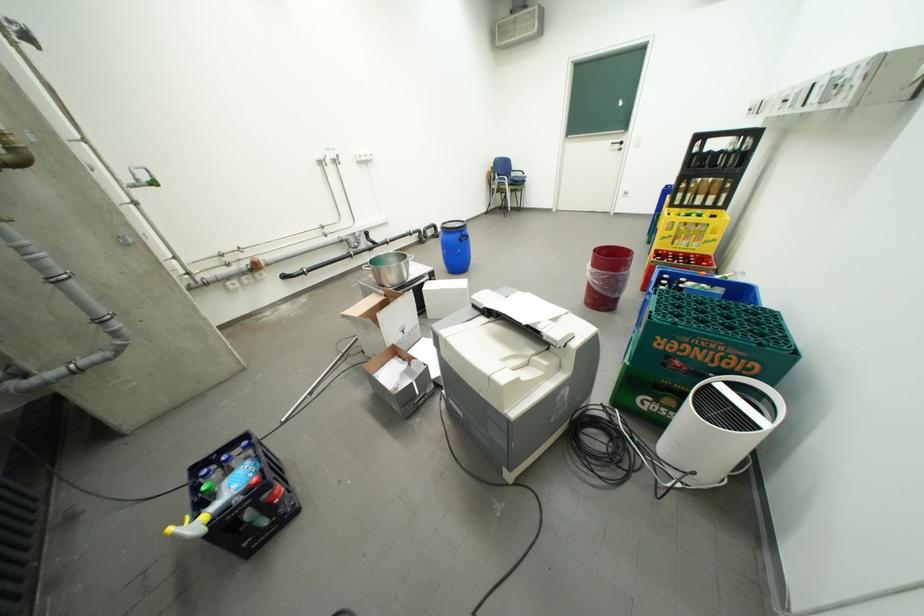
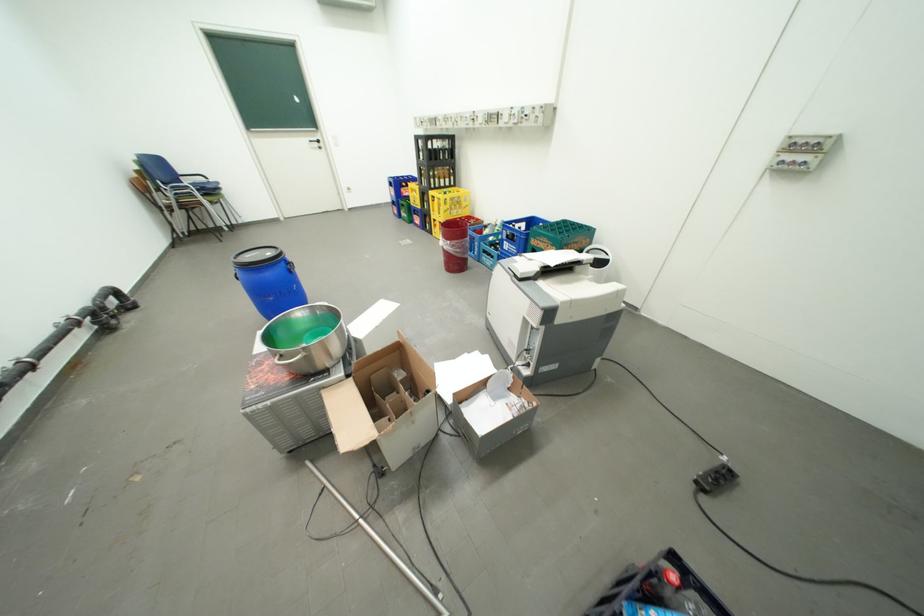
In the second image, find the point that corresponds to the point at 468,233 in the first image.

(290, 262)